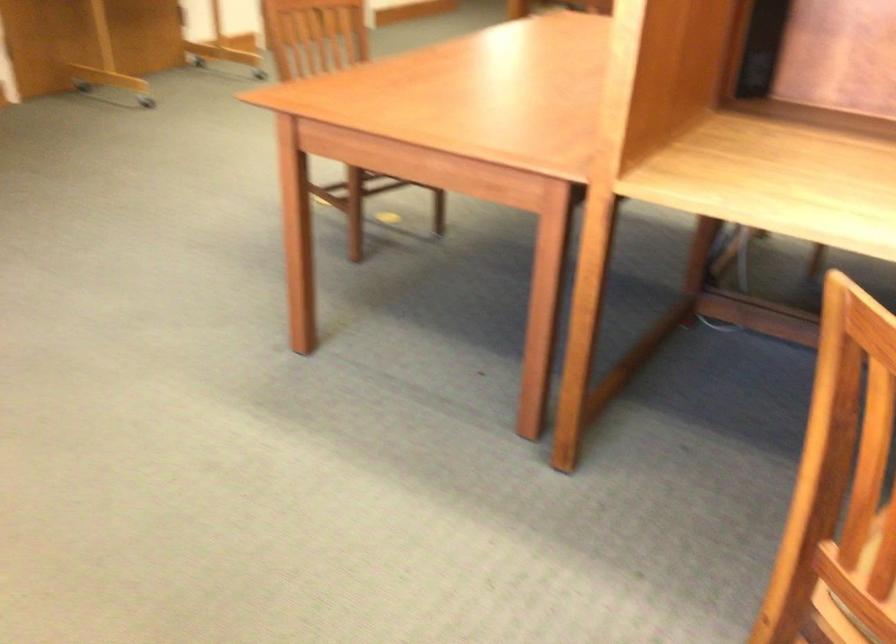
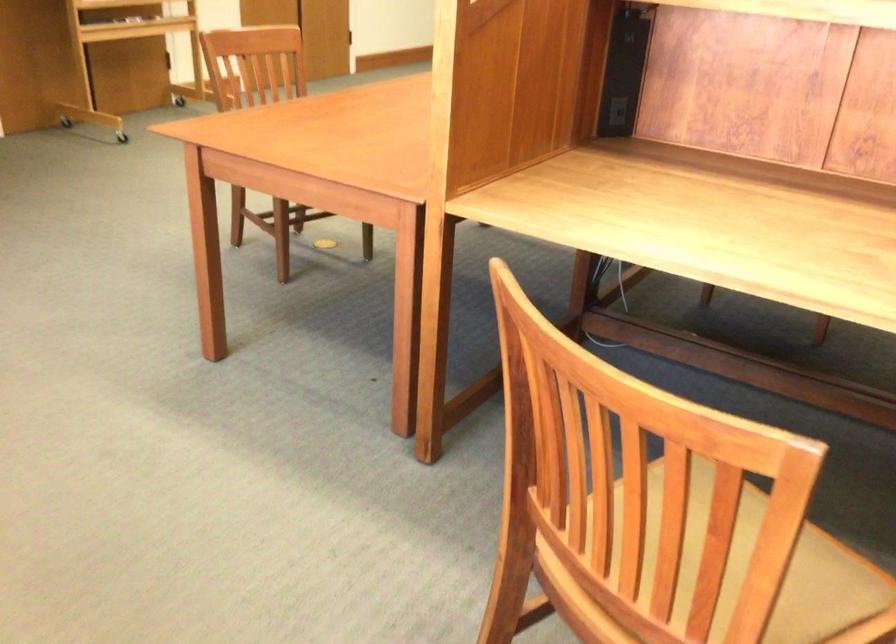
Where in the second image is the point corresponding to [762,68] from the first image?

(616, 111)